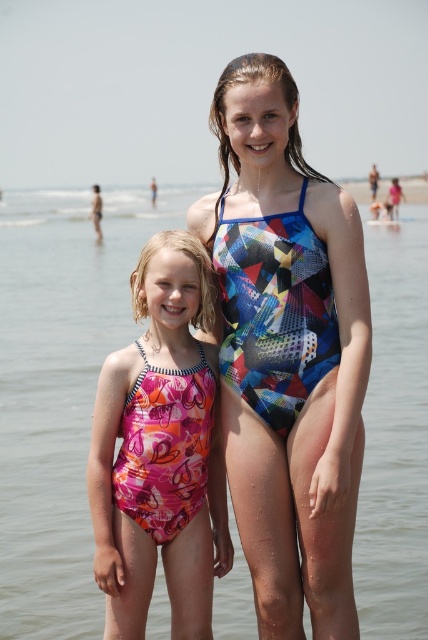
Question: Does pink fabric swimsuit at center appear under pink floral swimsuit at left?

Choices:
 (A) no
 (B) yes

Answer: (A)

Question: Which object appears farthest from the camera in this image?

Choices:
 (A) pink fabric swimsuit at center
 (B) pink floral swimsuit at left

Answer: (A)

Question: Is pink fabric swimsuit at center wider than pink floral swimsuit at left?

Choices:
 (A) no
 (B) yes

Answer: (B)

Question: Is the position of pink fabric swimsuit at center more distant than that of multicolored geometric swimsuit at center?

Choices:
 (A) yes
 (B) no

Answer: (A)

Question: Which object appears farthest from the camera in this image?

Choices:
 (A) beige sand at lower right
 (B) multicolored geometric swimsuit at center

Answer: (A)

Question: Which of the following is the farthest from the observer?

Choices:
 (A) (118, 580)
 (B) (386, 624)

Answer: (B)